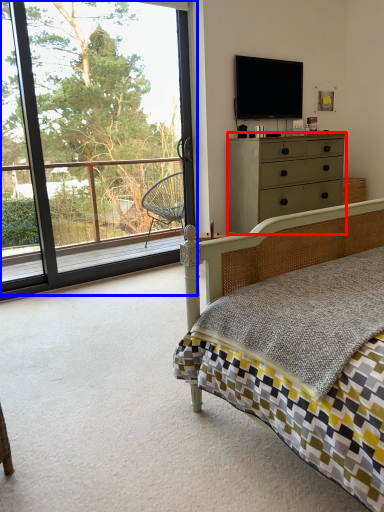
Question: Among these objects, which one is nearest to the camera, chest of drawers (highlighted by a red box) or window (highlighted by a blue box)?

Choices:
 (A) chest of drawers
 (B) window

Answer: (B)